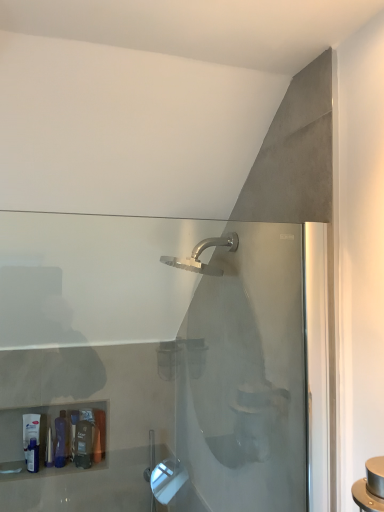
Describe the element at coordinates (84, 444) in the screenshot. I see `translucent plastic bottle at lower left, the third toiletry viewed from the left` at that location.

Measure the distance between point (66, 443) and camera.

1.89 meters.

How much space does translucent plastic tube at lower left, which is the second toiletry from left to right, occupy horizontally?

It is 2.89 inches.

How much space does matte white tube at lower left, the 3th toiletry in the right-to-left sequence, occupy vertically?

8.85 inches.

What do you see at coordinates (30, 430) in the screenshot? The width and height of the screenshot is (384, 512). I see `matte white tube at lower left, the 3th toiletry in the right-to-left sequence` at bounding box center [30, 430].

Find the location of `translucent plastic bottle at lower left, the third toiletry viewed from the left`. translucent plastic bottle at lower left, the third toiletry viewed from the left is located at coordinates (84, 444).

From a real-world perspective, count 2nd toiletrys downward from the matte white tube at lower left, the 3th toiletry in the right-to-left sequence, and point to it. Please provide its 2D coordinates.

[(84, 444)]

How much distance is there between matte white tube at lower left, the 3th toiletry in the right-to-left sequence, and translucent plastic bottle at lower left, placed as the 1th toiletry when sorted from right to left?

matte white tube at lower left, the 3th toiletry in the right-to-left sequence, and translucent plastic bottle at lower left, placed as the 1th toiletry when sorted from right to left, are 7.92 inches apart from each other.

Does matte white tube at lower left, arranged as the first toiletry when viewed from the left, have a greater width compared to translucent plastic bottle at lower left, placed as the 1th toiletry when sorted from right to left?

No, matte white tube at lower left, arranged as the first toiletry when viewed from the left, is not wider than translucent plastic bottle at lower left, placed as the 1th toiletry when sorted from right to left.

From the image's perspective, relative to translucent plastic bottle at lower left, the third toiletry viewed from the left, is matte white tube at lower left, arranged as the first toiletry when viewed from the left, above or below?

matte white tube at lower left, arranged as the first toiletry when viewed from the left, is situated higher than translucent plastic bottle at lower left, the third toiletry viewed from the left, in the image.

Looking at this image, from a real-world perspective, is matte white tube at lower left, arranged as the first toiletry when viewed from the left, located beneath translucent plastic tube at lower left, which appears as the 2th toiletry when viewed from the right?

Actually, matte white tube at lower left, arranged as the first toiletry when viewed from the left, is physically above translucent plastic tube at lower left, which appears as the 2th toiletry when viewed from the right, in the real world.

Are matte white tube at lower left, the 3th toiletry in the right-to-left sequence, and translucent plastic tube at lower left, which appears as the 2th toiletry when viewed from the right, located far from each other?

No, matte white tube at lower left, the 3th toiletry in the right-to-left sequence, is in close proximity to translucent plastic tube at lower left, which appears as the 2th toiletry when viewed from the right.

From the image's perspective, relative to translucent plastic tube at lower left, which is the second toiletry from left to right, is matte white tube at lower left, the 3th toiletry in the right-to-left sequence, above or below?

matte white tube at lower left, the 3th toiletry in the right-to-left sequence, is situated higher than translucent plastic tube at lower left, which is the second toiletry from left to right, in the image.

From a real-world perspective, is translucent plastic tube at lower left, which appears as the 2th toiletry when viewed from the right, on top of matte white tube at lower left, the 3th toiletry in the right-to-left sequence?

Incorrect, from a real-world perspective, translucent plastic tube at lower left, which appears as the 2th toiletry when viewed from the right, is lower than matte white tube at lower left, the 3th toiletry in the right-to-left sequence.

Is translucent plastic tube at lower left, which is the second toiletry from left to right, at the right side of matte white tube at lower left, the 3th toiletry in the right-to-left sequence?

Correct, you'll find translucent plastic tube at lower left, which is the second toiletry from left to right, to the right of matte white tube at lower left, the 3th toiletry in the right-to-left sequence.

Is translucent plastic tube at lower left, which is the second toiletry from left to right, further to camera compared to matte white tube at lower left, arranged as the first toiletry when viewed from the left?

No.

From the image's perspective, which one is positioned higher, translucent plastic tube at lower left, which is the second toiletry from left to right, or matte white tube at lower left, arranged as the first toiletry when viewed from the left?

matte white tube at lower left, arranged as the first toiletry when viewed from the left, from the image's perspective.

Is translucent plastic bottle at lower left, the third toiletry viewed from the left, completely or partially outside of translucent plastic tube at lower left, which is the second toiletry from left to right?

translucent plastic bottle at lower left, the third toiletry viewed from the left, lies outside translucent plastic tube at lower left, which is the second toiletry from left to right,'s area.

From the image's perspective, which one is positioned higher, translucent plastic bottle at lower left, the third toiletry viewed from the left, or translucent plastic tube at lower left, which is the second toiletry from left to right?

translucent plastic tube at lower left, which is the second toiletry from left to right, from the image's perspective.

Considering the relative positions of translucent plastic bottle at lower left, placed as the 1th toiletry when sorted from right to left, and translucent plastic tube at lower left, which is the second toiletry from left to right, in the image provided, is translucent plastic bottle at lower left, placed as the 1th toiletry when sorted from right to left, behind translucent plastic tube at lower left, which is the second toiletry from left to right,?

No, the depth of translucent plastic bottle at lower left, placed as the 1th toiletry when sorted from right to left, is less than that of translucent plastic tube at lower left, which is the second toiletry from left to right.

Is translucent plastic bottle at lower left, the third toiletry viewed from the left, shorter than translucent plastic tube at lower left, which is the second toiletry from left to right?

In fact, translucent plastic bottle at lower left, the third toiletry viewed from the left, may be taller than translucent plastic tube at lower left, which is the second toiletry from left to right.

Can you confirm if translucent plastic bottle at lower left, placed as the 1th toiletry when sorted from right to left, is wider than matte white tube at lower left, the 3th toiletry in the right-to-left sequence?

Yes.

Is translucent plastic bottle at lower left, placed as the 1th toiletry when sorted from right to left, positioned with its back to matte white tube at lower left, the 3th toiletry in the right-to-left sequence?

No, translucent plastic bottle at lower left, placed as the 1th toiletry when sorted from right to left, is not facing the opposite direction of matte white tube at lower left, the 3th toiletry in the right-to-left sequence.

Between translucent plastic bottle at lower left, placed as the 1th toiletry when sorted from right to left, and matte white tube at lower left, arranged as the first toiletry when viewed from the left, which one appears on the right side from the viewer's perspective?

translucent plastic bottle at lower left, placed as the 1th toiletry when sorted from right to left.

Which of these two, translucent plastic bottle at lower left, placed as the 1th toiletry when sorted from right to left, or matte white tube at lower left, the 3th toiletry in the right-to-left sequence, stands shorter?

translucent plastic bottle at lower left, placed as the 1th toiletry when sorted from right to left, is shorter.

Considering the relative sizes of translucent plastic tube at lower left, which appears as the 2th toiletry when viewed from the right, and translucent plastic bottle at lower left, the third toiletry viewed from the left, in the image provided, is translucent plastic tube at lower left, which appears as the 2th toiletry when viewed from the right, thinner than translucent plastic bottle at lower left, the third toiletry viewed from the left,?

No.

From the image's perspective, which is above, translucent plastic tube at lower left, which is the second toiletry from left to right, or translucent plastic bottle at lower left, the third toiletry viewed from the left?

From the image's view, translucent plastic tube at lower left, which is the second toiletry from left to right, is above.

Does translucent plastic tube at lower left, which appears as the 2th toiletry when viewed from the right, appear on the left side of translucent plastic bottle at lower left, the third toiletry viewed from the left?

Yes, translucent plastic tube at lower left, which appears as the 2th toiletry when viewed from the right, is to the left of translucent plastic bottle at lower left, the third toiletry viewed from the left.

Which point is more distant from viewer, (x=62, y=433) or (x=76, y=437)?

Positioned behind is point (x=76, y=437).

From the matte white tube at lower left, arranged as the first toiletry when viewed from the left, count 2nd toiletrys forward and point to it. Please provide its 2D coordinates.

[(84, 444)]

I want to click on toiletry above the translucent plastic tube at lower left, which is the second toiletry from left to right (from the image's perspective), so click(x=30, y=430).

Considering their positions, is translucent plastic tube at lower left, which is the second toiletry from left to right, positioned further to matte white tube at lower left, the 3th toiletry in the right-to-left sequence, than translucent plastic bottle at lower left, the third toiletry viewed from the left?

Among the two, translucent plastic bottle at lower left, the third toiletry viewed from the left, is located further to matte white tube at lower left, the 3th toiletry in the right-to-left sequence.

Which object lies nearer to the anchor point matte white tube at lower left, arranged as the first toiletry when viewed from the left, translucent plastic bottle at lower left, placed as the 1th toiletry when sorted from right to left, or translucent plastic tube at lower left, which appears as the 2th toiletry when viewed from the right?

translucent plastic tube at lower left, which appears as the 2th toiletry when viewed from the right, is closer to matte white tube at lower left, arranged as the first toiletry when viewed from the left.

When comparing their distances from translucent plastic bottle at lower left, the third toiletry viewed from the left, does matte white tube at lower left, the 3th toiletry in the right-to-left sequence, or translucent plastic tube at lower left, which is the second toiletry from left to right, seem further?

matte white tube at lower left, the 3th toiletry in the right-to-left sequence, lies further to translucent plastic bottle at lower left, the third toiletry viewed from the left, than the other object.

Looking at the image, which one is located further to translucent plastic tube at lower left, which is the second toiletry from left to right, translucent plastic bottle at lower left, placed as the 1th toiletry when sorted from right to left, or matte white tube at lower left, arranged as the first toiletry when viewed from the left?

Based on the image, matte white tube at lower left, arranged as the first toiletry when viewed from the left, appears to be further to translucent plastic tube at lower left, which is the second toiletry from left to right.

Consider the image. Based on their spatial positions, is matte white tube at lower left, the 3th toiletry in the right-to-left sequence, or translucent plastic bottle at lower left, the third toiletry viewed from the left, further from translucent plastic tube at lower left, which appears as the 2th toiletry when viewed from the right?

matte white tube at lower left, the 3th toiletry in the right-to-left sequence, is further to translucent plastic tube at lower left, which appears as the 2th toiletry when viewed from the right.

When comparing their distances from translucent plastic bottle at lower left, placed as the 1th toiletry when sorted from right to left, does translucent plastic tube at lower left, which appears as the 2th toiletry when viewed from the right, or matte white tube at lower left, arranged as the first toiletry when viewed from the left, seem closer?

translucent plastic tube at lower left, which appears as the 2th toiletry when viewed from the right, is positioned closer to the anchor translucent plastic bottle at lower left, placed as the 1th toiletry when sorted from right to left.

The height and width of the screenshot is (512, 384). What are the coordinates of `toiletry between matte white tube at lower left, arranged as the first toiletry when viewed from the left, and translucent plastic bottle at lower left, the third toiletry viewed from the left, from left to right` in the screenshot? It's located at (61, 440).